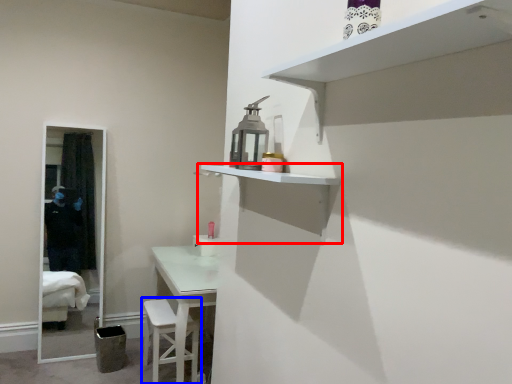
Question: Which of the following is the farthest to the observer, shelf (highlighted by a red box) or step stool (highlighted by a blue box)?

Choices:
 (A) shelf
 (B) step stool

Answer: (B)